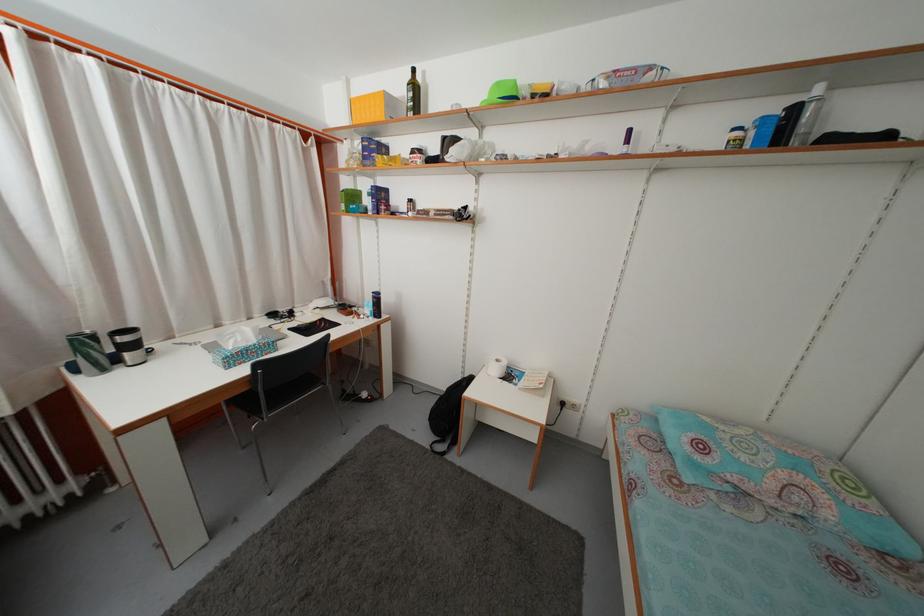
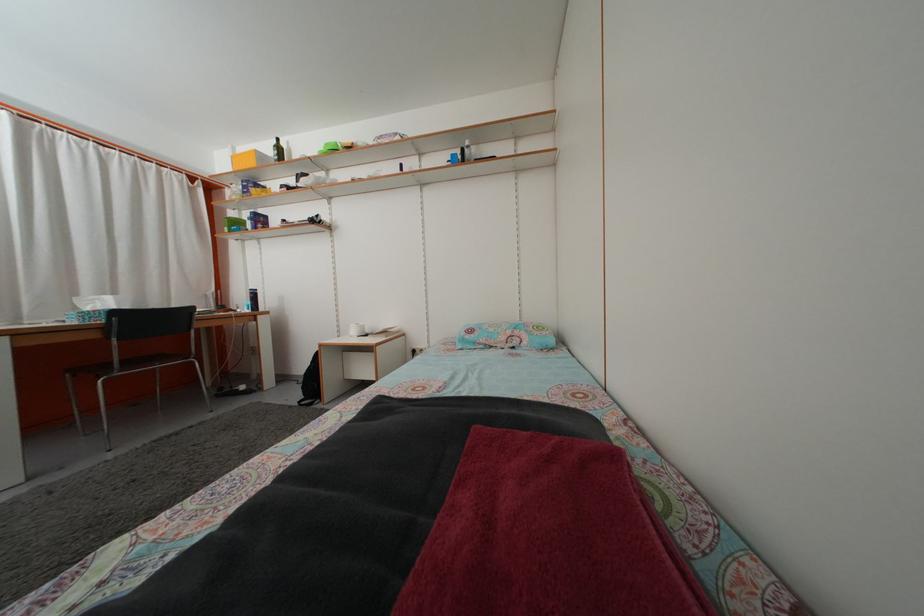
What movement of the cameraman would produce the second image?

The movement direction of the cameraman is right, backward.